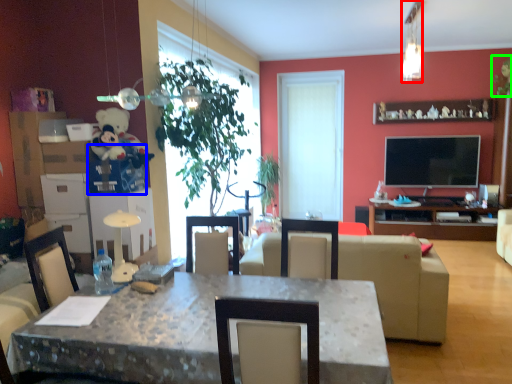
Question: Based on their relative distances, which object is nearer to lamp (highlighted by a red box)? Choose from box (highlighted by a blue box) and plant (highlighted by a green box).

Choices:
 (A) box
 (B) plant

Answer: (B)